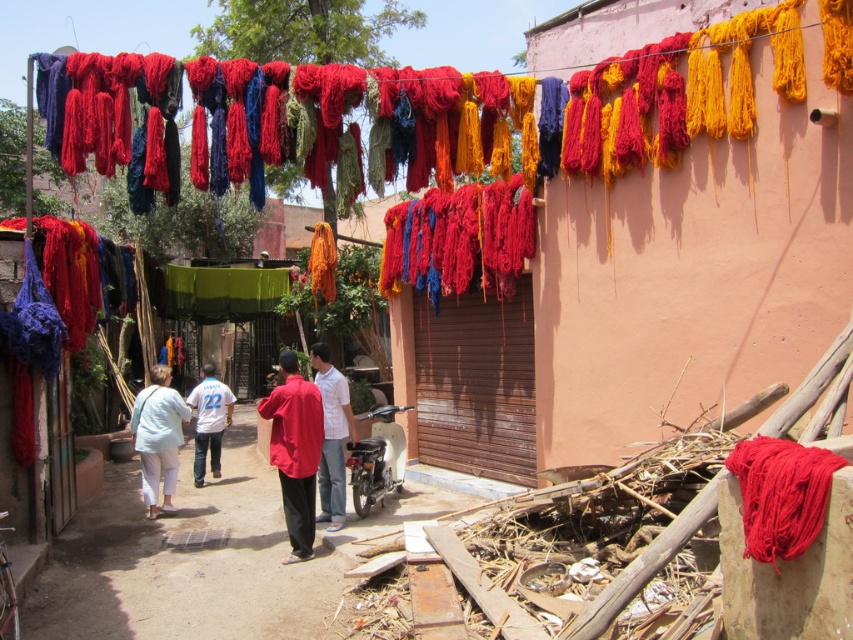
You are a delivery person trying to pass through the narrow alleyway. You see a matte white shirt at center and a white jersey at center hanging from the line. Which clothing item do you need to duck under first to avoid getting tangled?

The matte white shirt at center has a lesser width compared to white jersey at center, so you should duck under the matte white shirt at center first since it is narrower and might be closer to your path.